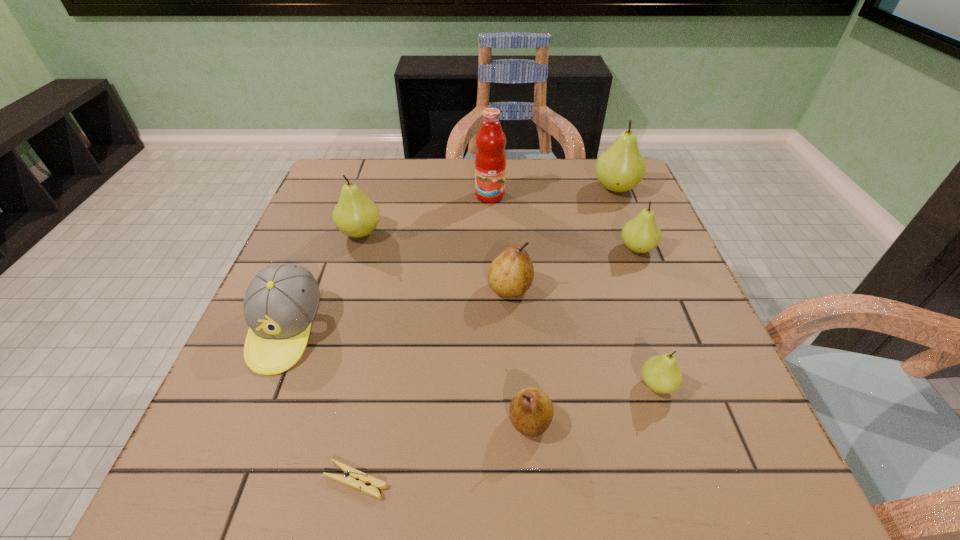
Find the location of a particular element. vacant space that satisfies the following two spatial constraints: 1. on the front-facing side of the baseball cap; 2. on the left side of the clothespin is located at coordinates (226, 481).